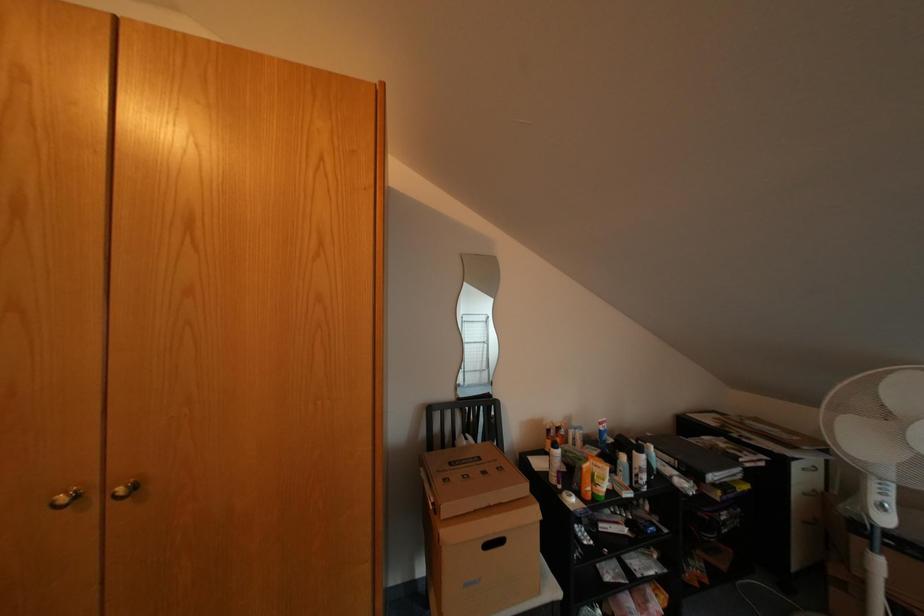
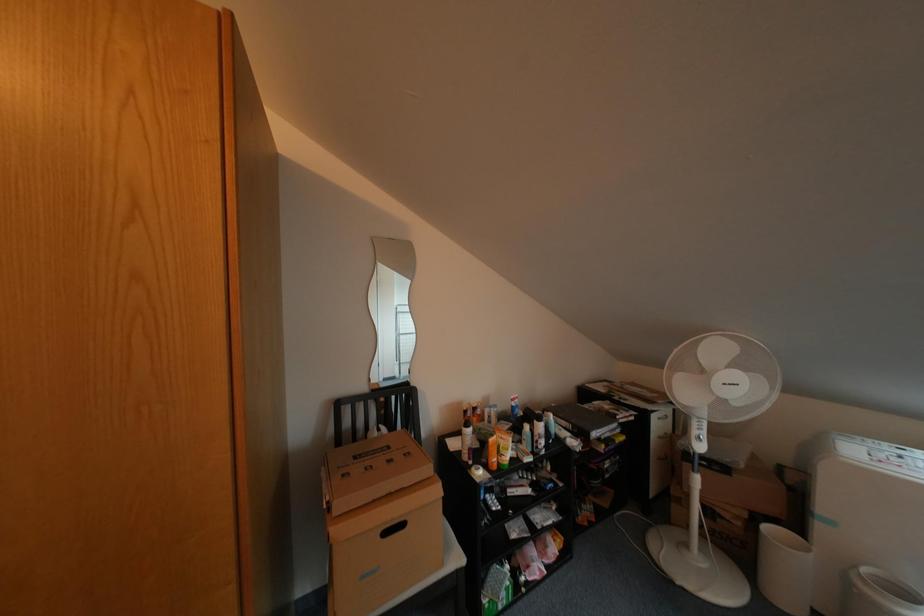
Question: The images are taken continuously from a first-person perspective. In which direction are you moving?

Choices:
 (A) Left
 (B) Right
 (C) Forward
 (D) Backward

Answer: (B)